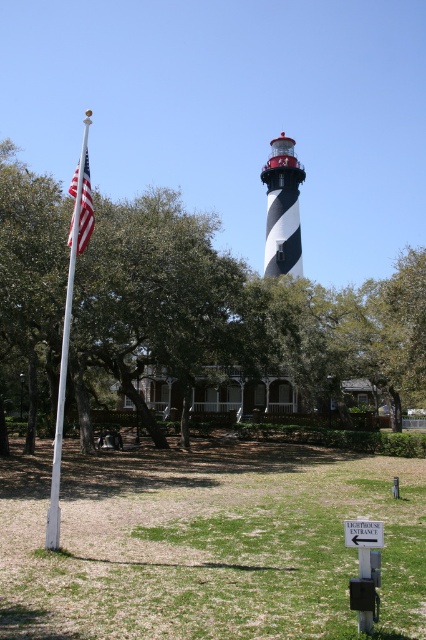
Can you confirm if green leafy tree at left is shorter than american flag at left?

No, green leafy tree at left is not shorter than american flag at left.

Who is more distant from viewer, (25, 198) or (75, 172)?

The point (75, 172) is behind.

The height and width of the screenshot is (640, 426). I want to click on green leafy tree at left, so click(236, 320).

Can you confirm if white painted wood flag pole at left is taller than american flag at left?

Yes, white painted wood flag pole at left is taller than american flag at left.

Identify the location of white painted wood flag pole at left. Image resolution: width=426 pixels, height=640 pixels. (69, 317).

Is point (86, 125) positioned after point (89, 170)?

Yes.

Find the location of a particular element. The height and width of the screenshot is (640, 426). white painted wood flag pole at left is located at coordinates (69, 317).

Between black and white striped lighthouse at center and american flag at left, which one is positioned higher?

american flag at left

Which is behind, point (290, 257) or point (81, 248)?

The point (290, 257) is behind.

Between point (276, 257) and point (78, 237), which one is positioned in front?

Point (78, 237) is more forward.

This screenshot has height=640, width=426. Identify the location of black and white striped lighthouse at center. (282, 209).